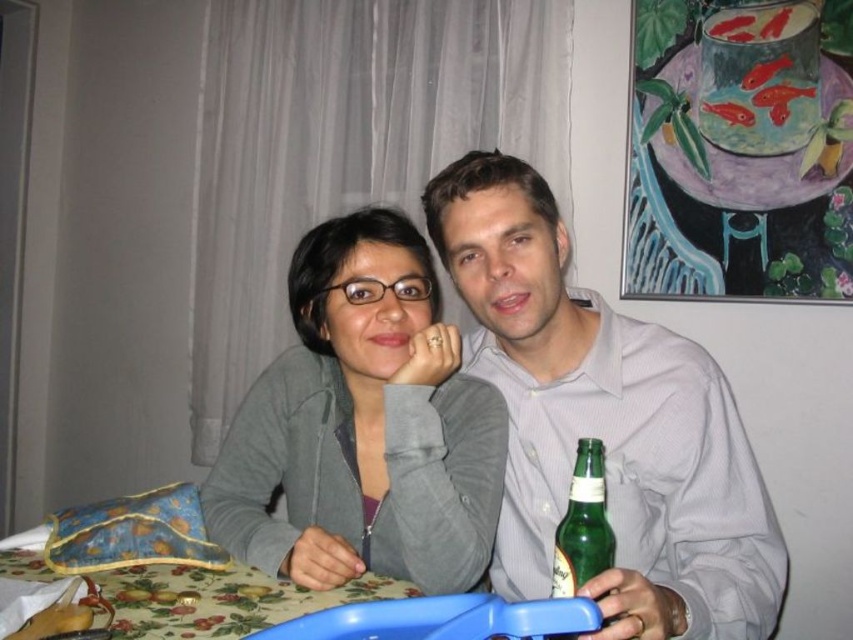
You are a photographer standing in front of the table. You want to place a small decoration at the point with coordinates (604, 422). According to the image, where should you place it?

The point (604, 422) is on the gray cotton shirt at center, so you should place the decoration on the gray cotton shirt at center.

You are planning to place a small vase on the table between the floral fabric table at lower center and the green glass bottle at right. Which object should the vase be placed closer to if you want it to be near the larger object?

The vase should be placed closer to the floral fabric table at lower center because it is larger than the green glass bottle at right.